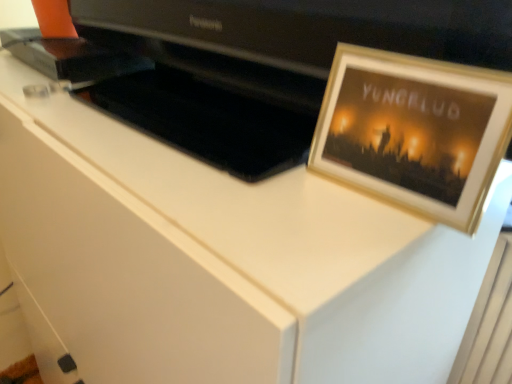
What do you see at coordinates (414, 131) in the screenshot?
I see `gold-framed picture at upper right` at bounding box center [414, 131].

At what (x,y) coordinates should I click in order to perform the action: click on gold-framed picture at upper right. Please return your answer as a coordinate pair (x, y). The image size is (512, 384). Looking at the image, I should click on pos(414,131).

Where is `gold-framed picture at upper right`? Image resolution: width=512 pixels, height=384 pixels. gold-framed picture at upper right is located at coordinates (414, 131).